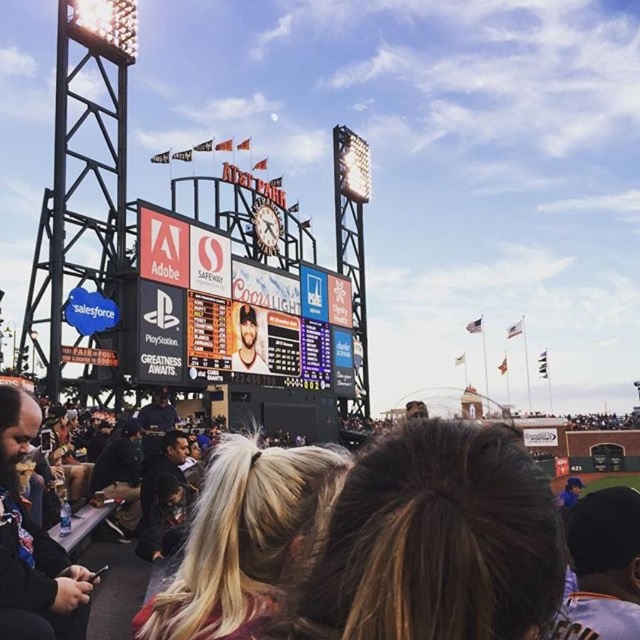
Question: Does brown hair at lower center lie in front of matte baseball cap at center?

Choices:
 (A) yes
 (B) no

Answer: (A)

Question: Can you confirm if brown hair at lower center is bigger than dark brown leather jacket at lower left?

Choices:
 (A) no
 (B) yes

Answer: (B)

Question: Which point appears farthest from the camera in this image?

Choices:
 (A) (518, 476)
 (B) (244, 326)
 (C) (13, 528)
 (D) (276, 376)

Answer: (D)

Question: Is black glossy scoreboard at center positioned in front of dark brown leather jacket at lower left?

Choices:
 (A) yes
 (B) no

Answer: (B)

Question: Which object is the closest to the brown hair at lower center?

Choices:
 (A) black glossy scoreboard at center
 (B) dark brown leather jacket at lower left

Answer: (B)

Question: Which point appears closest to the camera in this image?

Choices:
 (A) (241, 358)
 (B) (157, 224)
 (C) (22, 595)
 (D) (68, 608)

Answer: (C)